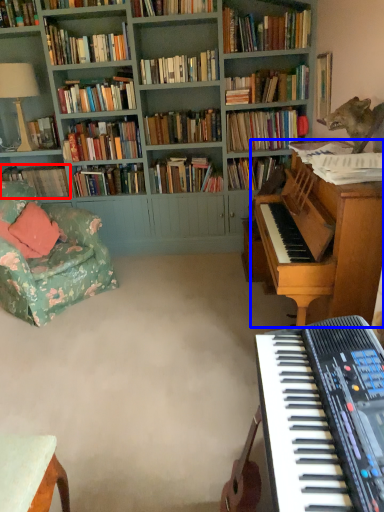
Question: Among these objects, which one is farthest to the camera, book (highlighted by a red box) or piano (highlighted by a blue box)?

Choices:
 (A) book
 (B) piano

Answer: (A)